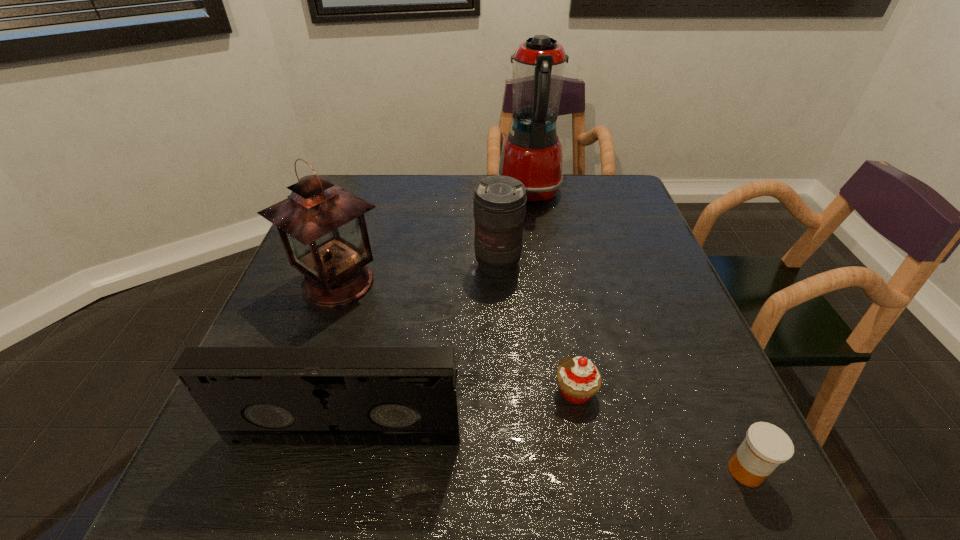
Image resolution: width=960 pixels, height=540 pixels. In order to click on blank space that satisfies the following two spatial constraints: 1. on the controls of the third nearest object; 2. on the left side of the farthest object in this screenshot , I will do `click(561, 392)`.

Where is `vacant space that satisfies the following two spatial constraints: 1. on the side of the cupcake where the control switches are located; 2. on the left side of the telephoto lens`? The width and height of the screenshot is (960, 540). vacant space that satisfies the following two spatial constraints: 1. on the side of the cupcake where the control switches are located; 2. on the left side of the telephoto lens is located at coordinates (504, 392).

The height and width of the screenshot is (540, 960). What are the coordinates of `free space that satisfies the following two spatial constraints: 1. on the side of the telephoto lens where the control switches are located; 2. on the left side of the cupcake` in the screenshot? It's located at (504, 392).